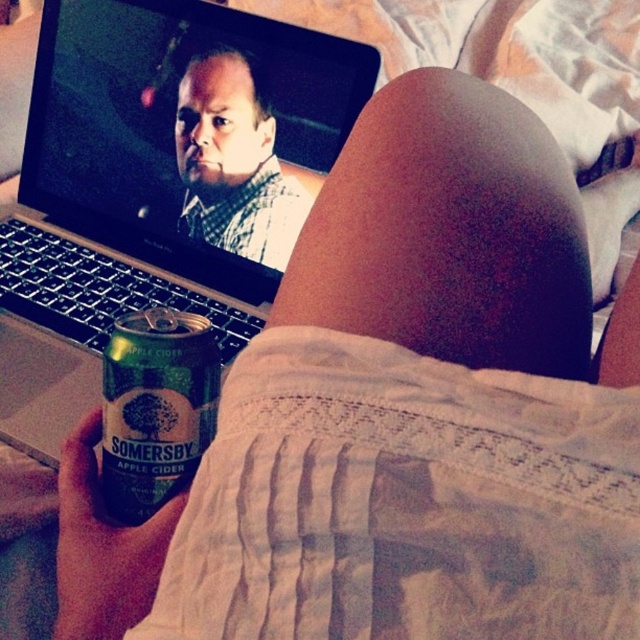
Question: Which object appears farthest from the camera in this image?

Choices:
 (A) green matte can at lower left
 (B) silver metallic laptop at upper left

Answer: (B)

Question: Is silver metallic laptop at upper left below green matte can at lower left?

Choices:
 (A) yes
 (B) no

Answer: (B)

Question: Is the position of silver metallic laptop at upper left more distant than that of green matte can at lower left?

Choices:
 (A) yes
 (B) no

Answer: (A)

Question: Is silver metallic laptop at upper left further to camera compared to matte black shirt at upper center?

Choices:
 (A) yes
 (B) no

Answer: (B)

Question: Considering the real-world distances, which object is farthest from the silver metallic laptop at upper left?

Choices:
 (A) matte black shirt at upper center
 (B) green matte can at lower left

Answer: (B)

Question: Which point is closer to the camera taking this photo?

Choices:
 (A) (230, 58)
 (B) (180, 352)

Answer: (B)